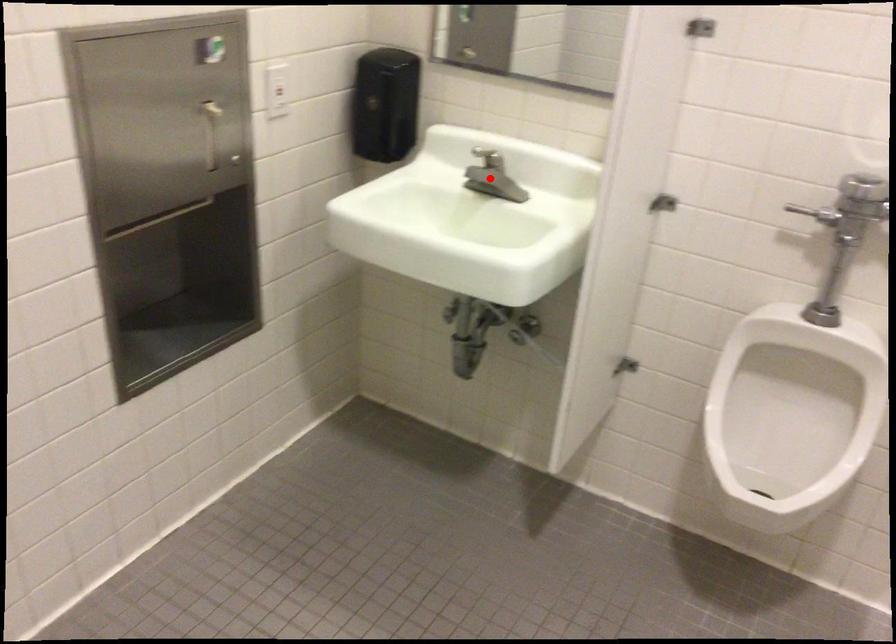
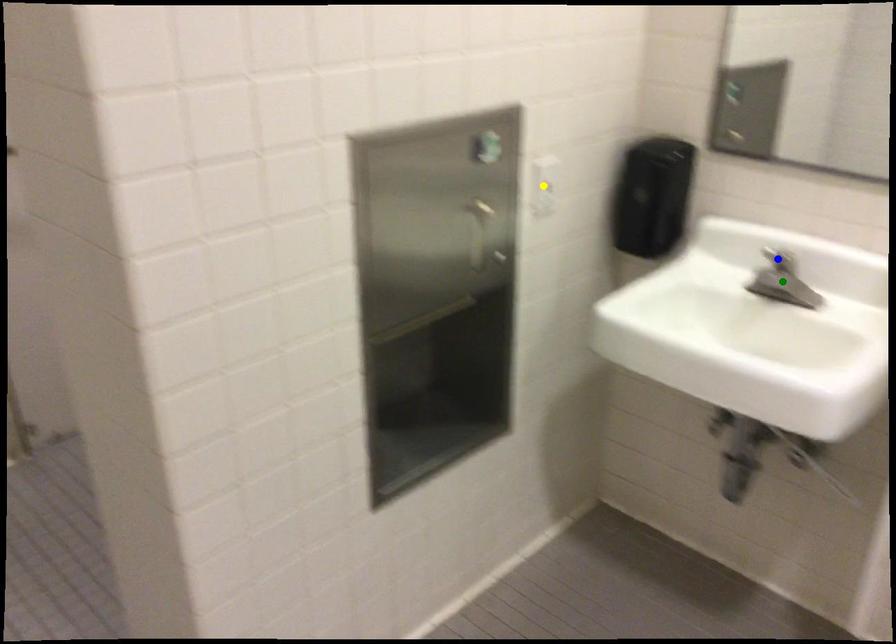
Question: I am providing you with two images of the same scene from different viewpoints. A red point is marked on the first image. You are given multiple points on the second image. Which point in image 2 represents the same 3d spot as the red point in image 1?

Choices:
 (A) blue point
 (B) green point
 (C) yellow point

Answer: (B)